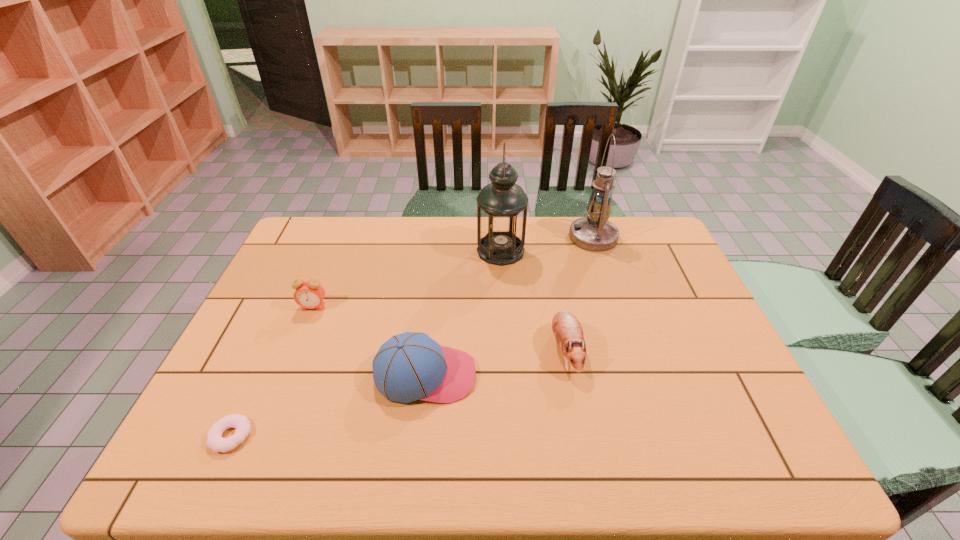
Where is `vacant area situated 0.070m on the front-facing side of the baseball cap`? Image resolution: width=960 pixels, height=540 pixels. vacant area situated 0.070m on the front-facing side of the baseball cap is located at coordinates (504, 375).

This screenshot has height=540, width=960. Identify the location of vacant region located at the face of the fifth object from left to right. (580, 426).

Image resolution: width=960 pixels, height=540 pixels. Identify the location of blank space located on the back of the nearest object. (255, 381).

Image resolution: width=960 pixels, height=540 pixels. Identify the location of object located at the near edge. (215, 441).

Locate an element on the screen. alarm clock that is at the left edge is located at coordinates (309, 294).

The width and height of the screenshot is (960, 540). Find the location of `doughnut at the left edge`. doughnut at the left edge is located at coordinates (215, 441).

Find the location of a particular element. The width and height of the screenshot is (960, 540). object that is at the near left corner is located at coordinates (215, 441).

At what (x,y) coordinates should I click in order to perform the action: click on blank area at the far edge. Please return your answer as a coordinate pair (x, y). Image resolution: width=960 pixels, height=540 pixels. Looking at the image, I should click on (551, 248).

At what (x,y) coordinates should I click in order to perform the action: click on free space at the near edge of the desktop. Please return your answer as a coordinate pair (x, y). This screenshot has width=960, height=540. Looking at the image, I should click on (520, 448).

The height and width of the screenshot is (540, 960). In order to click on blank space at the left edge of the desktop in this screenshot , I will do `click(278, 279)`.